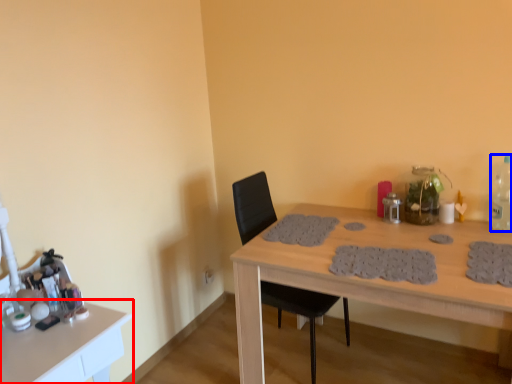
Question: Among these objects, which one is farthest to the camera, table (highlighted by a red box) or bottle (highlighted by a blue box)?

Choices:
 (A) table
 (B) bottle

Answer: (B)